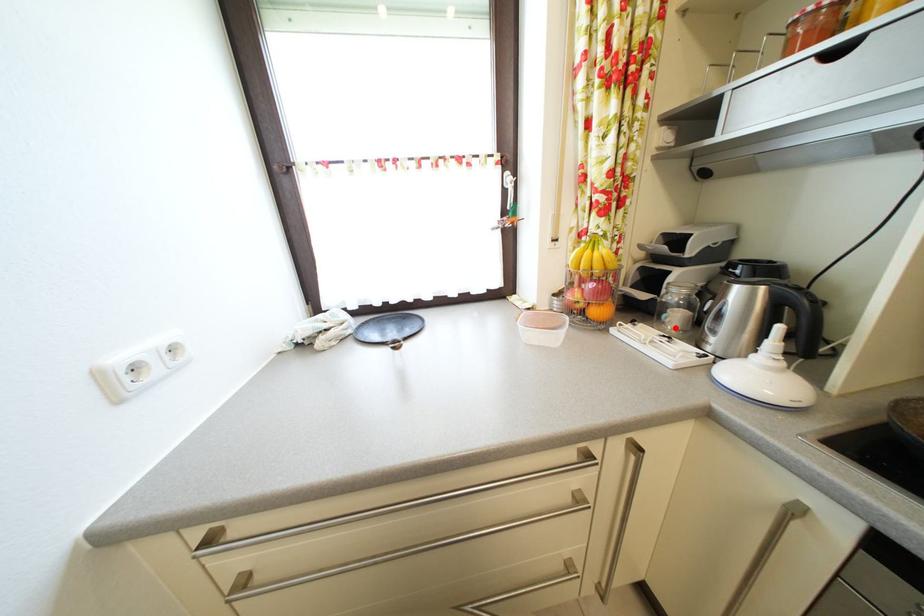
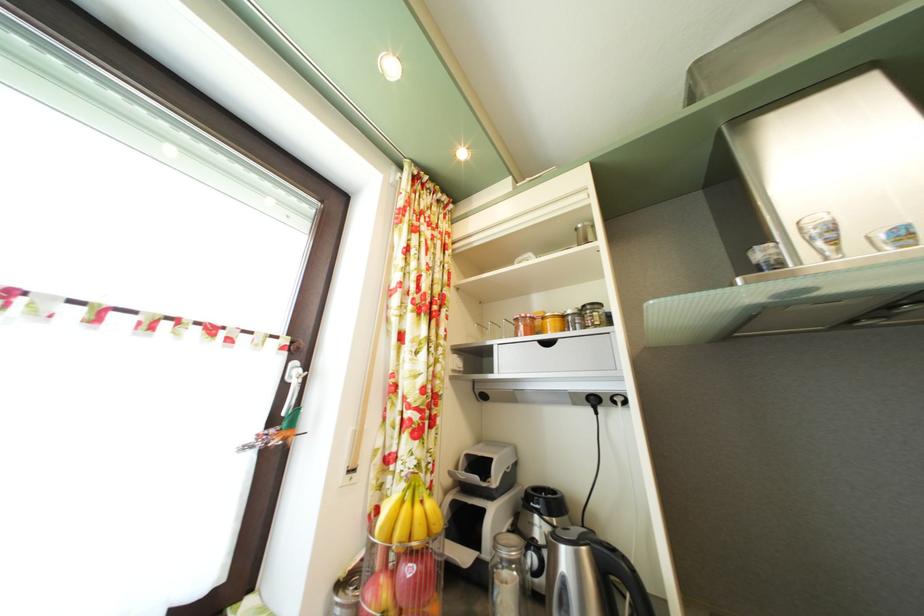
Locate, in the second image, the point that corresponds to the highlighted location in the first image.

(506, 608)